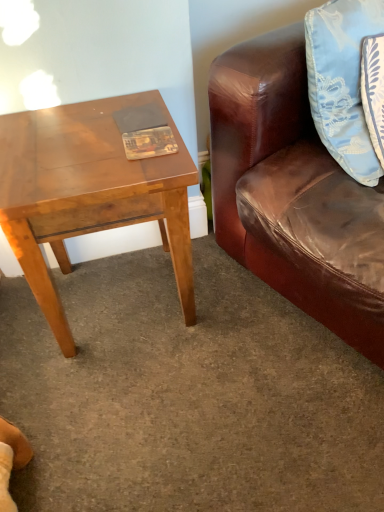
Find the location of a particular element. The image size is (384, 512). vacant area situated below light brown wooden table at left (from a real-world perspective) is located at coordinates (127, 294).